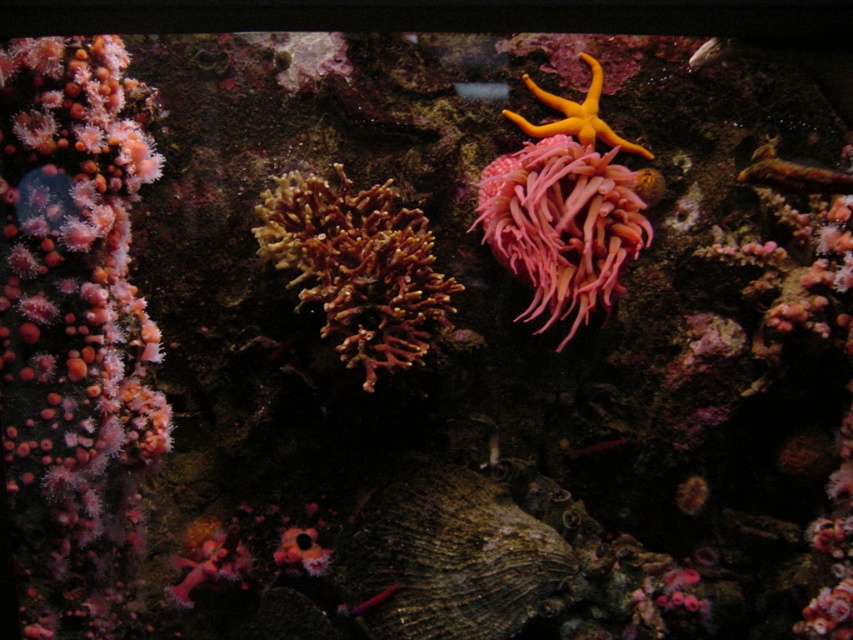
From the picture: You are a marine biologist studying underwater ecosystems. You have a map marking a specific point at coordinates [73,323]. According to the image, what marine feature is located at this point?

The point at coordinates [73,323] is marked as pink coral at left.

You are a marine biologist observing the underwater scene. You need to place a small sensor on the object that takes up more space between the rough textured shell at center and the brown textured coral at center. Which object should you choose?

The brown textured coral at center takes up more space than the rough textured shell at center, so you should place the sensor on the brown textured coral at center.